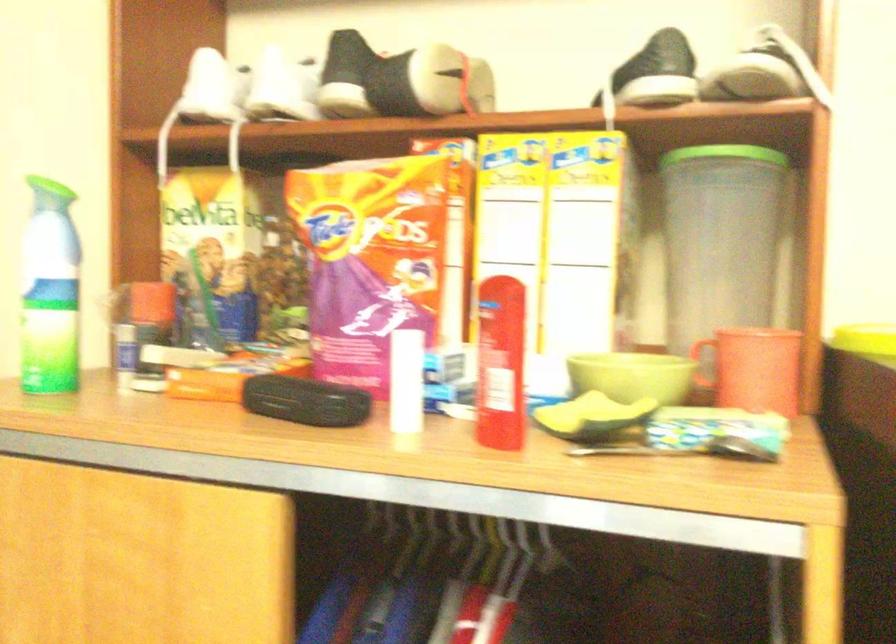
At what (x,y) coordinates should I click in order to perform the action: click on black glasses case. Please return your answer as a coordinate pair (x, y). Looking at the image, I should click on (306, 401).